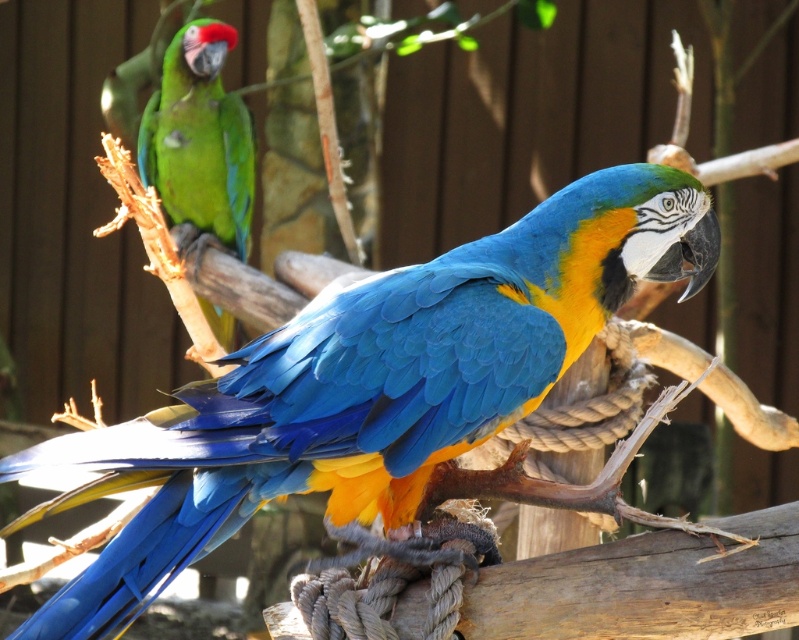
Question: Is blue glossy parrot at center thinner than green matte parrot at upper left?

Choices:
 (A) yes
 (B) no

Answer: (B)

Question: From the image, what is the correct spatial relationship of blue glossy parrot at center in relation to green matte parrot at upper left?

Choices:
 (A) above
 (B) below

Answer: (B)

Question: Which object is closer to the camera taking this photo?

Choices:
 (A) blue glossy parrot at center
 (B) green matte parrot at upper left

Answer: (A)

Question: Is the position of blue glossy parrot at center less distant than that of green matte parrot at upper left?

Choices:
 (A) yes
 (B) no

Answer: (A)

Question: Which point is closer to the camera taking this photo?

Choices:
 (A) (716, 253)
 (B) (221, 228)

Answer: (A)